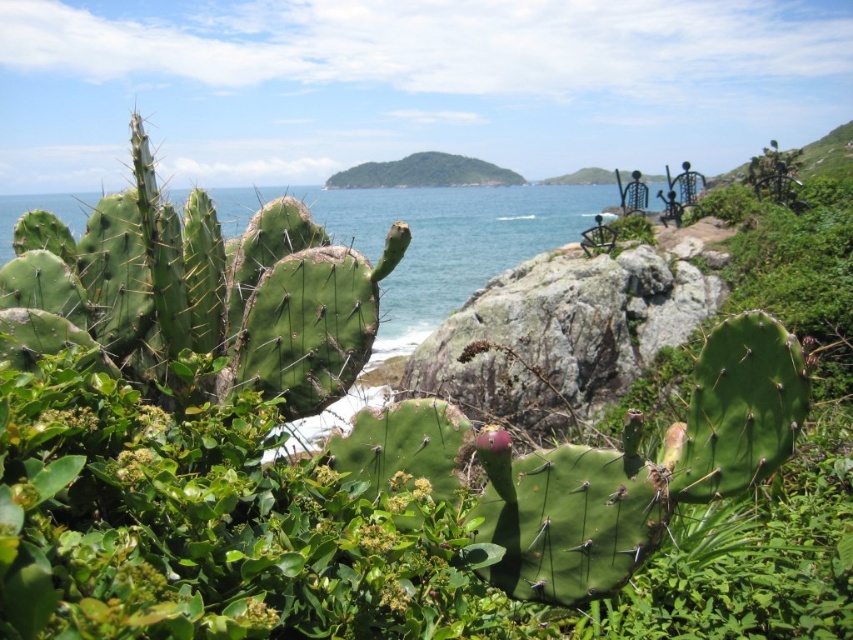
Is rocky at center thinner than green water at center?

Yes.

Is rocky at center wider than green water at center?

No.

Where is `rocky at center`? This screenshot has width=853, height=640. rocky at center is located at coordinates (560, 336).